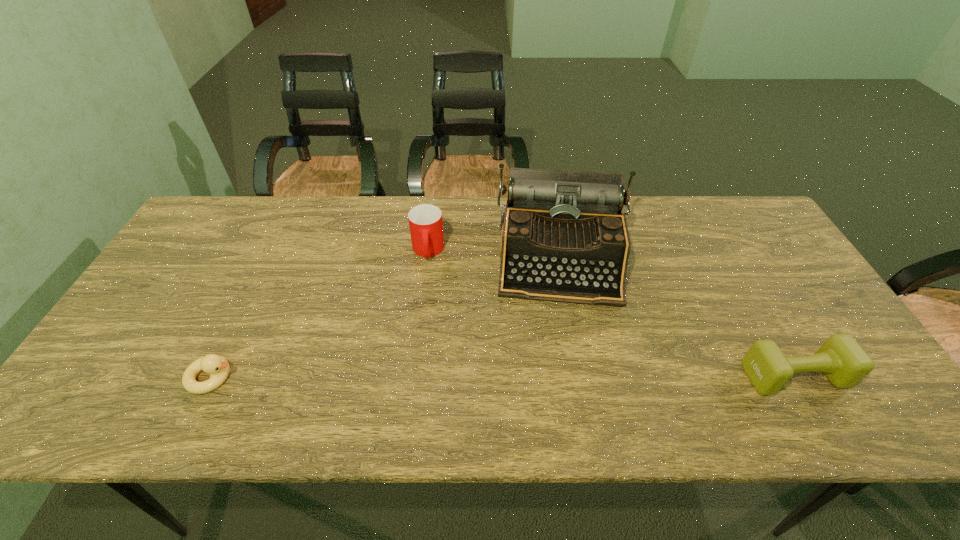
Image resolution: width=960 pixels, height=540 pixels. Find the location of `the shortest object`. the shortest object is located at coordinates (218, 367).

Locate an element on the screen. This screenshot has height=540, width=960. the leftmost object is located at coordinates (218, 367).

The height and width of the screenshot is (540, 960). I want to click on the rightmost object, so click(x=843, y=361).

You are a GUI agent. You are given a task and a screenshot of the screen. Output one action in this format:
    pyautogui.click(x=<x>, y=<y>)
    Task: Click on the second shortest object
    The image size is (960, 540).
    Given the screenshot: What is the action you would take?
    pyautogui.click(x=843, y=361)

Identify the location of the third object from left to right. (564, 238).

Where is `the tallest object`? Image resolution: width=960 pixels, height=540 pixels. the tallest object is located at coordinates (564, 238).

You are a GUI agent. You are given a task and a screenshot of the screen. Output one action in this format:
    pyautogui.click(x=<x>, y=<y>)
    Task: Click on the second object from left to right
    
    Given the screenshot: What is the action you would take?
    pyautogui.click(x=425, y=221)

At what (x,y) coordinates should I click in order to perform the action: click on the second tallest object. Please return your answer as a coordinate pair (x, y). Looking at the image, I should click on (425, 221).

Identify the location of vacant space located 0.220m at the beak of the shortest object. (331, 377).

You are a GUI agent. You are given a task and a screenshot of the screen. Output one action in this format:
    pyautogui.click(x=<x>, y=<y>)
    Task: Click on the vacant space located 0.050m on the right of the rightmost object
    
    Given the screenshot: What is the action you would take?
    pyautogui.click(x=865, y=376)